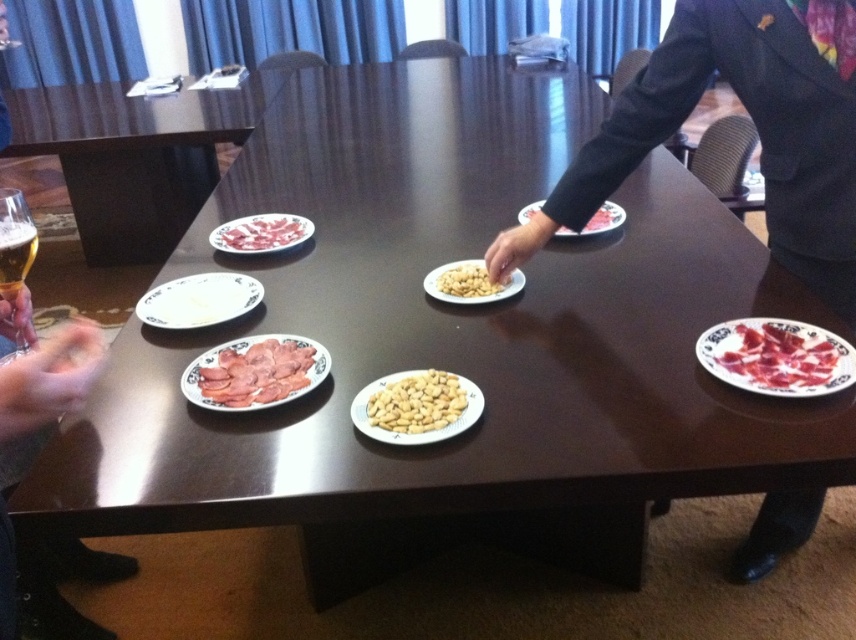
Question: Is matte black table at left above white glossy plate at lower left?

Choices:
 (A) yes
 (B) no

Answer: (A)

Question: From the image, what is the correct spatial relationship of white glossy plate at lower left in relation to white matte peanuts at center?

Choices:
 (A) below
 (B) above

Answer: (B)

Question: Does white glossy plate at lower left appear under yellow matte peanuts at center?

Choices:
 (A) no
 (B) yes

Answer: (B)

Question: Which point is farther to the camera?

Choices:
 (A) (314, 349)
 (B) (519, 218)

Answer: (B)

Question: Which point is farther to the camera?

Choices:
 (A) white matte peanuts at center
 (B) sliced pink meat at upper left
 (C) white glossy plate at lower left

Answer: (B)

Question: Which point appears farthest from the camera in this image?

Choices:
 (A) (395, 392)
 (B) (602, 227)

Answer: (B)